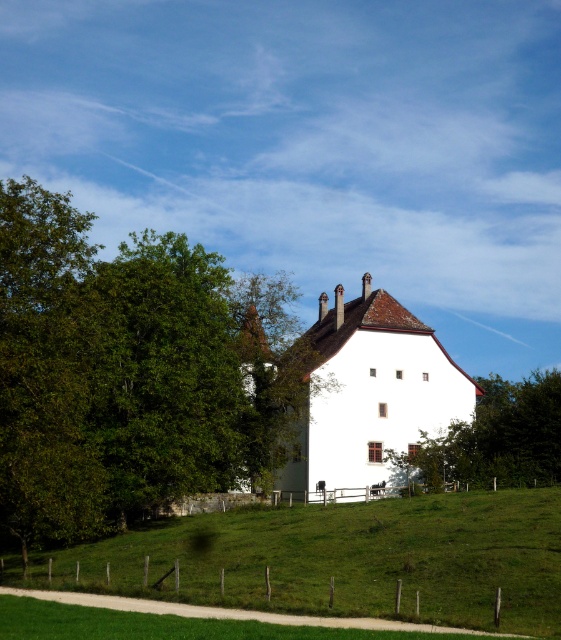
You are standing at the edge of the dirt path and want to walk towards the building. Which area would you step on first, the green grassy at lower center or the green leafy tree at center?

You would step on the green grassy at lower center first because it is closer to you than the green leafy tree at center.

In the scene shown: You are standing at the entrance of the estate and want to reach the green grassy hillside at lower center. According to the coordinates provided, in which direction should you walk from your current position?

The green grassy hillside at lower center is located at coordinates point (342,557), so you should walk towards the lower center direction to reach it.